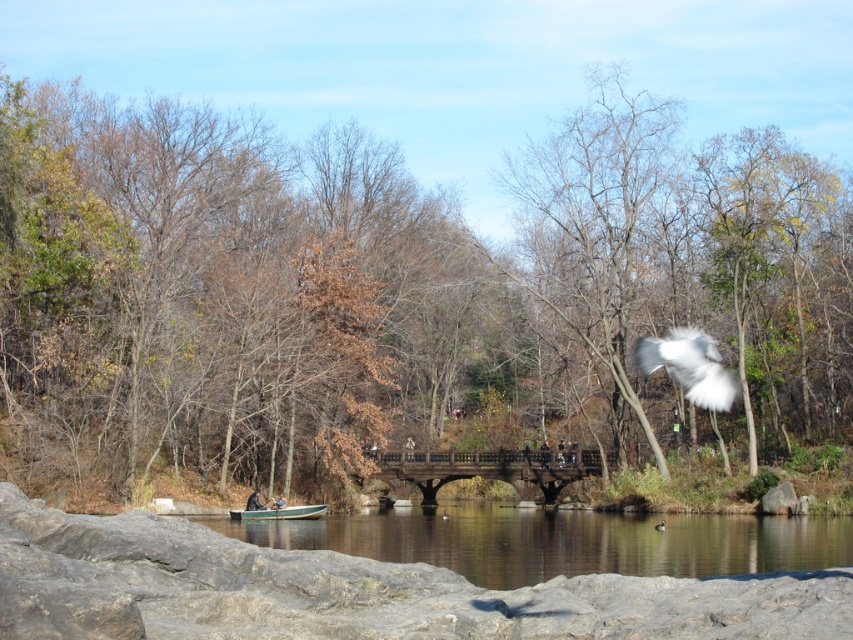
Where is `brown leafy tree at center`? The width and height of the screenshot is (853, 640). brown leafy tree at center is located at coordinates (393, 296).

Can you confirm if brown leafy tree at center is thinner than wooden boat at lower center?

No.

Image resolution: width=853 pixels, height=640 pixels. Describe the element at coordinates (393, 296) in the screenshot. I see `brown leafy tree at center` at that location.

Where is `brown leafy tree at center`? brown leafy tree at center is located at coordinates (393, 296).

Describe the element at coordinates (689, 365) in the screenshot. I see `white fluffy bird at upper right` at that location.

Is white fluffy bird at upper right wider than wooden boat at lower center?

Correct, the width of white fluffy bird at upper right exceeds that of wooden boat at lower center.

Image resolution: width=853 pixels, height=640 pixels. I want to click on white fluffy bird at upper right, so click(x=689, y=365).

Image resolution: width=853 pixels, height=640 pixels. What are the coordinates of `white fluffy bird at upper right` in the screenshot? It's located at (689, 365).

Who is lower down, brown leafy tree at center or white fluffy bird at upper right?

white fluffy bird at upper right is below.

Does brown leafy tree at center have a lesser width compared to white fluffy bird at upper right?

No, brown leafy tree at center is not thinner than white fluffy bird at upper right.

Find the location of a particular element. This screenshot has width=853, height=640. brown leafy tree at center is located at coordinates (393, 296).